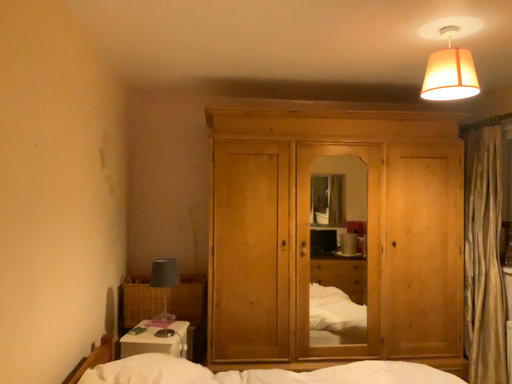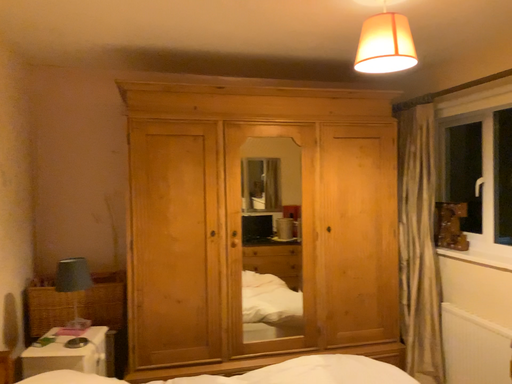
Question: How did the camera likely rotate when shooting the video?

Choices:
 (A) rotated left
 (B) rotated right

Answer: (B)